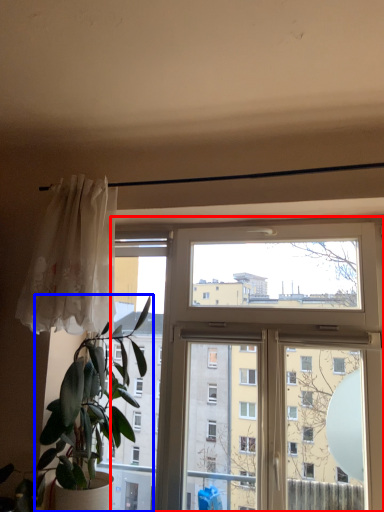
Question: Which object appears closest to the camera in this image, window (highlighted by a red box) or houseplant (highlighted by a blue box)?

Choices:
 (A) window
 (B) houseplant

Answer: (B)